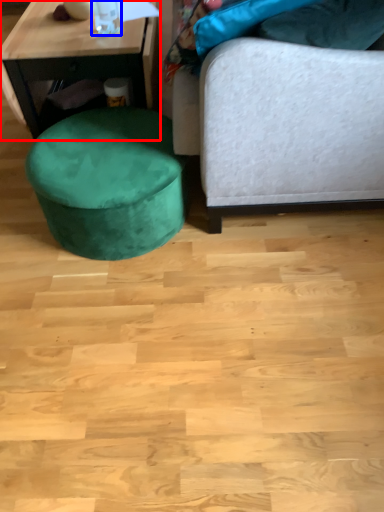
Question: Which of the following is the closest to the observer, table (highlighted by a red box) or bottle (highlighted by a blue box)?

Choices:
 (A) table
 (B) bottle

Answer: (B)